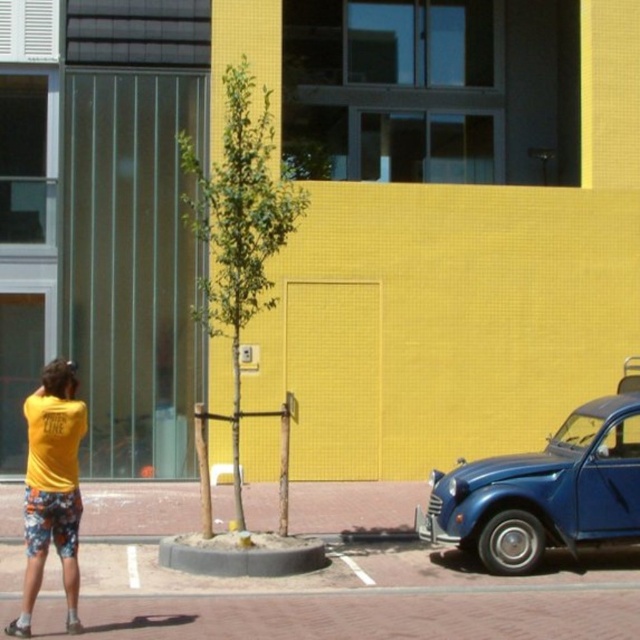
Consider the image. You are at a beach and see two pairs of shorts. One is yellow matte shorts at lower left and the other is floral cotton shorts at lower left. Which pair is positioned more to the left?

The yellow matte shorts at lower left are positioned more to the left than the floral cotton shorts at lower left.

You are a delivery person who needs to park your 1.8 meters tall delivery box next to the glossy blue car at right without blocking the yellow matte shorts at lower left. Can you place the box next to the car?

The glossy blue car at right is not as tall as yellow matte shorts at lower left, so placing the delivery box next to the car would not block the yellow matte shorts at lower left as the car is shorter than the shorts.